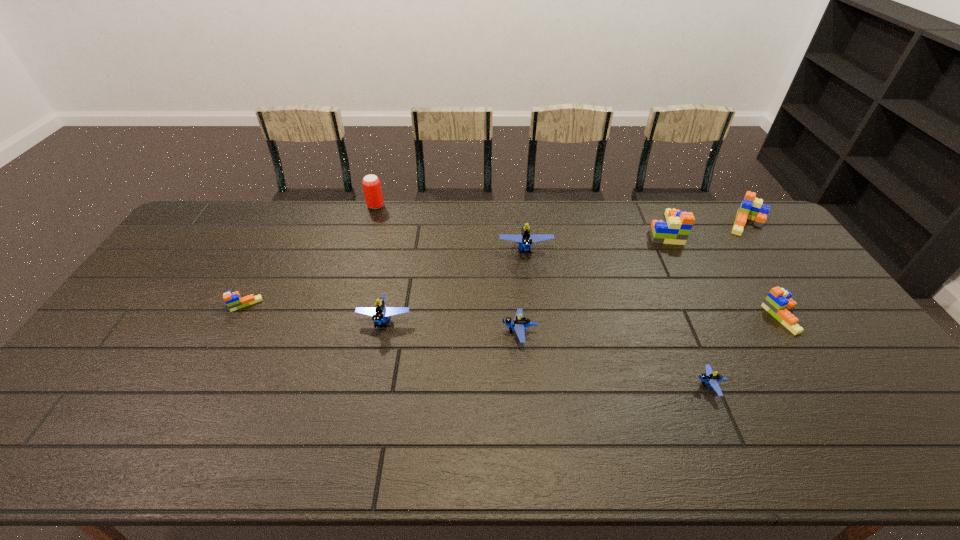
This screenshot has width=960, height=540. In the image, there is a desktop. Find the location of `free space at the right edge`. free space at the right edge is located at coordinates (777, 249).

Where is `vacant space at the near left corner of the desktop`? The image size is (960, 540). vacant space at the near left corner of the desktop is located at coordinates (21, 461).

At what (x,y) coordinates should I click in order to perform the action: click on vacant area between the third smallest orange Lego and the third biggest orange Lego. Please return your answer as a coordinate pair (x, y). This screenshot has width=960, height=540. Looking at the image, I should click on (764, 270).

Image resolution: width=960 pixels, height=540 pixels. What are the coordinates of `vacant region between the second biggest orange Lego and the biggest blue Lego` in the screenshot? It's located at (636, 237).

The width and height of the screenshot is (960, 540). Find the location of `unoccupied area between the leftmost orange Lego and the farthest blue Lego`. unoccupied area between the leftmost orange Lego and the farthest blue Lego is located at coordinates (385, 276).

Image resolution: width=960 pixels, height=540 pixels. Identify the location of empty space between the nearest Lego and the third smallest orange Lego. (728, 305).

Where is `free space between the second Lego from left to right and the beer can`? free space between the second Lego from left to right and the beer can is located at coordinates (380, 264).

You are a GUI agent. You are given a task and a screenshot of the screen. Output one action in this format:
    pyautogui.click(x=<x>, y=<y>)
    Task: Click on the vacant space that is in between the second smallest blue Lego and the nearest object
    Image resolution: width=960 pixels, height=540 pixels.
    Given the screenshot: What is the action you would take?
    pyautogui.click(x=614, y=359)

Identify the location of vacant area that lies between the smallest orange Lego and the third smallest orange Lego. [494, 264].

Locate an element on the screen. This screenshot has width=960, height=540. empty space that is in between the seventh Lego from right to left and the second smallest blue Lego is located at coordinates (452, 327).